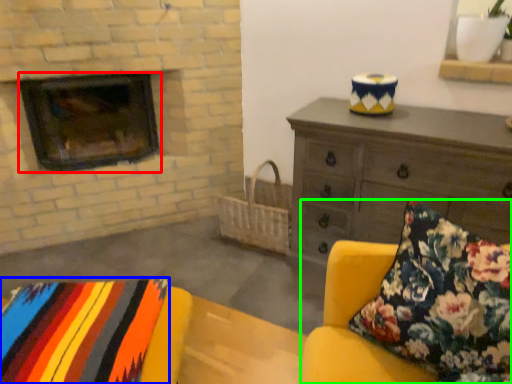
Question: Which object is positioned farthest from wood burning stove (highlighted by a red box)? Select from blanket (highlighted by a blue box) and studio couch (highlighted by a green box).

Choices:
 (A) blanket
 (B) studio couch

Answer: (B)